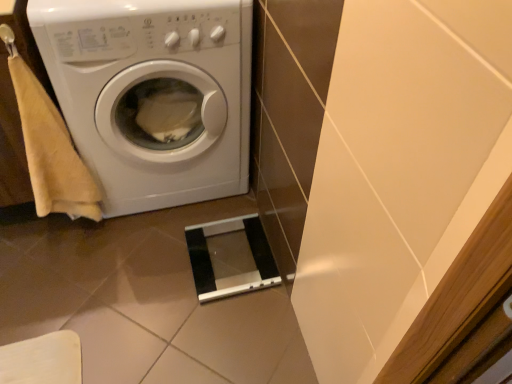
What do you see at coordinates (151, 94) in the screenshot? I see `white glossy washing machine at left` at bounding box center [151, 94].

Measure the distance between point (124, 32) and camera.

The distance of point (124, 32) from camera is 3.79 feet.

What are the coordinates of `white glossy washing machine at left` in the screenshot? It's located at (151, 94).

This screenshot has height=384, width=512. Find the location of `beige cotton hand towel at left`. beige cotton hand towel at left is located at coordinates (51, 150).

What do you see at coordinates (51, 150) in the screenshot? I see `beige cotton hand towel at left` at bounding box center [51, 150].

The height and width of the screenshot is (384, 512). What are the coordinates of `white glossy washing machine at left` in the screenshot? It's located at click(x=151, y=94).

Considering the relative positions of white glossy washing machine at left and beige cotton hand towel at left in the image provided, is white glossy washing machine at left to the right of beige cotton hand towel at left from the viewer's perspective?

Correct, you'll find white glossy washing machine at left to the right of beige cotton hand towel at left.

Which is behind, white glossy washing machine at left or beige cotton hand towel at left?

white glossy washing machine at left.

Does point (196, 79) come farther from viewer compared to point (29, 119)?

Yes, it is.

From the image's perspective, is white glossy washing machine at left located above beige cotton hand towel at left?

Indeed, from the image's perspective, white glossy washing machine at left is shown above beige cotton hand towel at left.

From a real-world perspective, is white glossy washing machine at left physically located above or below beige cotton hand towel at left?

white glossy washing machine at left is below beige cotton hand towel at left.

Considering the relative sizes of white glossy washing machine at left and beige cotton hand towel at left in the image provided, is white glossy washing machine at left thinner than beige cotton hand towel at left?

No, white glossy washing machine at left is not thinner than beige cotton hand towel at left.

In the scene shown: Does white glossy washing machine at left have a greater height compared to beige cotton hand towel at left?

Yes.

Based on their sizes in the image, would you say white glossy washing machine at left is bigger or smaller than beige cotton hand towel at left?

white glossy washing machine at left is bigger than beige cotton hand towel at left.

Is white glossy washing machine at left located outside beige cotton hand towel at left?

white glossy washing machine at left lies outside beige cotton hand towel at left's area.

Is white glossy washing machine at left far away from beige cotton hand towel at left?

Actually, white glossy washing machine at left and beige cotton hand towel at left are a little close together.

Is white glossy washing machine at left aimed at beige cotton hand towel at left?

No, white glossy washing machine at left does not turn towards beige cotton hand towel at left.

Measure the distance from white glossy washing machine at left to beige cotton hand towel at left.

A distance of 9.17 inches exists between white glossy washing machine at left and beige cotton hand towel at left.

This screenshot has height=384, width=512. What are the coordinates of `washing machine located on the right of beige cotton hand towel at left` in the screenshot? It's located at (151, 94).

Is beige cotton hand towel at left at the left side of white glossy washing machine at left?

Yes, beige cotton hand towel at left is to the left of white glossy washing machine at left.

Which object is further away from the camera, beige cotton hand towel at left or white glossy washing machine at left?

white glossy washing machine at left is more distant.

Does point (33, 159) come closer to viewer compared to point (125, 60)?

No, (33, 159) is behind (125, 60).

From the image's perspective, which is above, beige cotton hand towel at left or white glossy washing machine at left?

From the image's view, white glossy washing machine at left is above.

From a real-world perspective, is beige cotton hand towel at left physically below white glossy washing machine at left?

No, from a real-world perspective, beige cotton hand towel at left is not under white glossy washing machine at left.

Considering the sizes of objects beige cotton hand towel at left and white glossy washing machine at left in the image provided, who is thinner, beige cotton hand towel at left or white glossy washing machine at left?

Thinner between the two is beige cotton hand towel at left.

Which of these two, beige cotton hand towel at left or white glossy washing machine at left, stands shorter?

beige cotton hand towel at left is shorter.

Considering the relative sizes of beige cotton hand towel at left and white glossy washing machine at left in the image provided, is beige cotton hand towel at left smaller than white glossy washing machine at left?

Correct, beige cotton hand towel at left occupies less space than white glossy washing machine at left.

Is beige cotton hand towel at left spatially inside white glossy washing machine at left, or outside of it?

Answer: beige cotton hand towel at left is outside white glossy washing machine at left.

Is beige cotton hand towel at left beside white glossy washing machine at left?

No.

Is beige cotton hand towel at left oriented away from white glossy washing machine at left?

No, beige cotton hand towel at left is not facing away from white glossy washing machine at left.

Locate an element on the screen. washing machine above the beige cotton hand towel at left (from the image's perspective) is located at coordinates (151, 94).

The width and height of the screenshot is (512, 384). I want to click on washing machine directly beneath the beige cotton hand towel at left (from a real-world perspective), so click(151, 94).

The height and width of the screenshot is (384, 512). Identify the location of hand towel that is on the left side of white glossy washing machine at left. (51, 150).